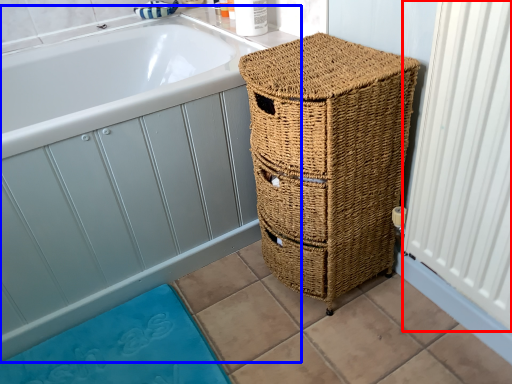
Question: Which point is further to the camera, radiator (highlighted by a red box) or bath (highlighted by a blue box)?

Choices:
 (A) radiator
 (B) bath

Answer: (B)